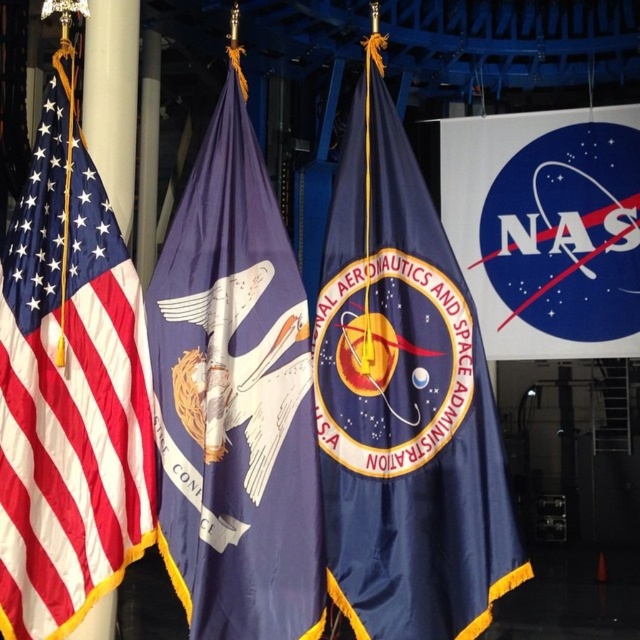
Question: Does navy blue satin nasa flag at center have a smaller size compared to matte blue flag with white emblem at center?

Choices:
 (A) yes
 (B) no

Answer: (B)

Question: Which of these objects is positioned closest to the matte fabric flag at left?

Choices:
 (A) navy blue satin nasa flag at center
 (B) matte blue flag with white emblem at center

Answer: (B)

Question: Can you confirm if navy blue satin nasa flag at center is bigger than matte fabric flag at left?

Choices:
 (A) yes
 (B) no

Answer: (A)

Question: Based on their relative distances, which object is nearer to the matte blue flag with white emblem at center?

Choices:
 (A) matte fabric flag at left
 (B) navy blue satin nasa flag at center

Answer: (A)

Question: Considering the real-world distances, which object is farthest from the navy blue satin nasa flag at center?

Choices:
 (A) matte blue flag with white emblem at center
 (B) matte fabric flag at left

Answer: (B)

Question: Does navy blue satin nasa flag at center appear on the right side of matte fabric flag at left?

Choices:
 (A) no
 (B) yes

Answer: (B)